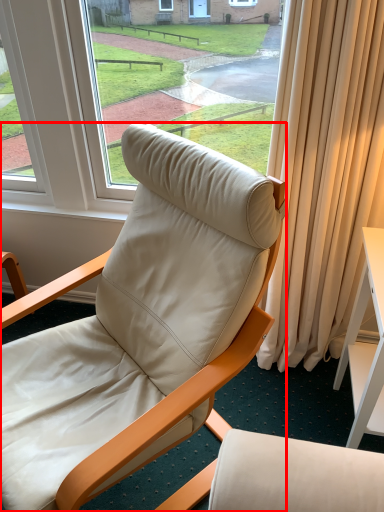
Question: In this image, where is chair (annotated by the red box) located relative to desk?

Choices:
 (A) right
 (B) left

Answer: (B)